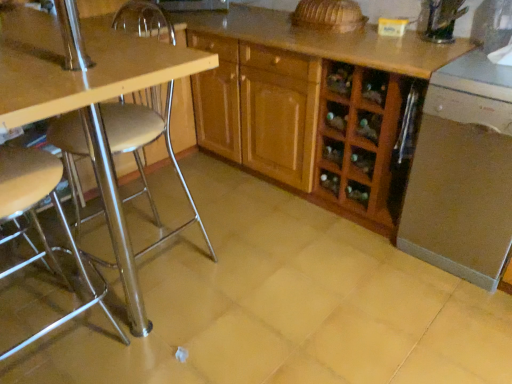
You are a GUI agent. You are given a task and a screenshot of the screen. Output one action in this format:
    pyautogui.click(x=<x>, y=<y>)
    Task: Click on the free area in between metallic silver stool at left and metallic silver stool at left
    The image size is (512, 384).
    Given the screenshot: What is the action you would take?
    pyautogui.click(x=110, y=327)